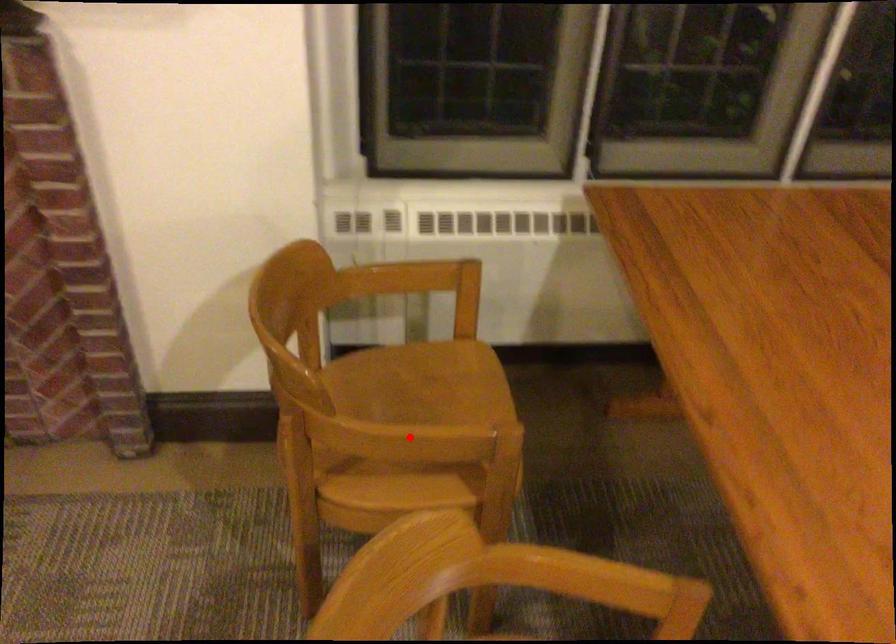
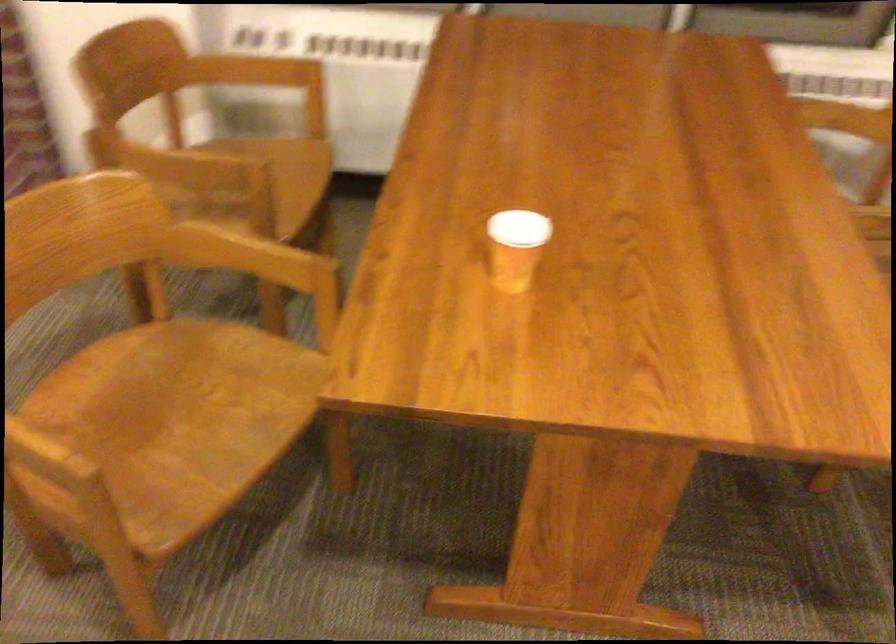
Question: A red point is marked in image1. In image2, is the corresponding 3D point closer to the camera or farther? Reply with the corresponding letter.

Choices:
 (A) The corresponding 3D point is closer.
 (B) The corresponding 3D point is farther.

Answer: (B)